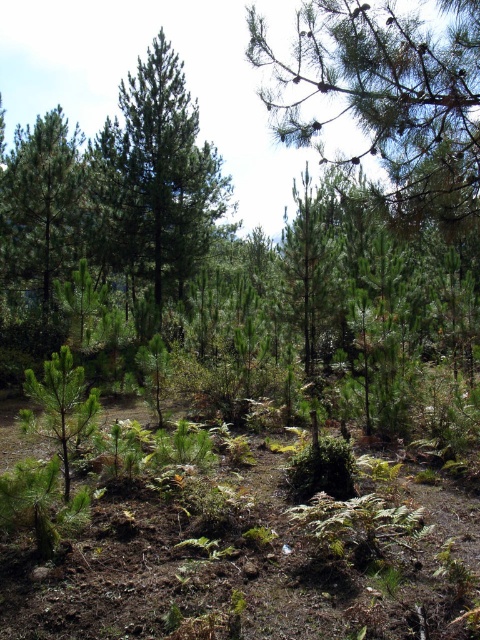
Question: Does green matte tree at center lie behind green matte tree at left?

Choices:
 (A) no
 (B) yes

Answer: (A)

Question: Which object appears closest to the camera in this image?

Choices:
 (A) green matte tree at left
 (B) green matte tree at center

Answer: (B)

Question: Is the position of green matte tree at center less distant than that of green matte tree at left?

Choices:
 (A) no
 (B) yes

Answer: (B)

Question: Does green matte tree at center appear on the left side of green matte tree at left?

Choices:
 (A) yes
 (B) no

Answer: (B)